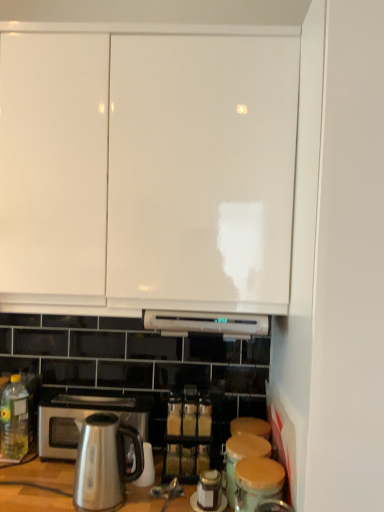
Question: Is wooden lid canister at lower center, which appears as the second appliance when viewed from the front, bigger than yellow translucent bottle at lower left?

Choices:
 (A) yes
 (B) no

Answer: (A)

Question: Is the position of wooden lid canister at lower center, the first appliance when ordered from back to front, more distant than that of yellow translucent bottle at lower left?

Choices:
 (A) yes
 (B) no

Answer: (B)

Question: Can you confirm if wooden lid canister at lower center, which appears as the second appliance when viewed from the front, is taller than yellow translucent bottle at lower left?

Choices:
 (A) yes
 (B) no

Answer: (B)

Question: Does wooden lid canister at lower center, the first appliance when ordered from back to front, have a greater width compared to yellow translucent bottle at lower left?

Choices:
 (A) yes
 (B) no

Answer: (A)

Question: Are wooden lid canister at lower center, the first appliance when ordered from back to front, and yellow translucent bottle at lower left making contact?

Choices:
 (A) yes
 (B) no

Answer: (B)

Question: Is wooden lid canister at lower center, which appears as the second appliance when viewed from the front, thinner than yellow translucent bottle at lower left?

Choices:
 (A) yes
 (B) no

Answer: (B)

Question: Does matte brown canister at lower right, the 2th appliance from the back, lie behind satin silver microwave oven at lower left?

Choices:
 (A) no
 (B) yes

Answer: (A)

Question: Is matte brown canister at lower right, the first appliance in the front-to-back sequence, not inside satin silver microwave oven at lower left?

Choices:
 (A) no
 (B) yes

Answer: (B)

Question: Is matte brown canister at lower right, the first appliance in the front-to-back sequence, looking in the opposite direction of satin silver microwave oven at lower left?

Choices:
 (A) yes
 (B) no

Answer: (B)

Question: Is matte brown canister at lower right, the first appliance in the front-to-back sequence, in contact with satin silver microwave oven at lower left?

Choices:
 (A) no
 (B) yes

Answer: (A)

Question: Does matte brown canister at lower right, the first appliance in the front-to-back sequence, have a larger size compared to satin silver microwave oven at lower left?

Choices:
 (A) no
 (B) yes

Answer: (A)

Question: From a real-world perspective, does matte brown canister at lower right, the first appliance in the front-to-back sequence, sit lower than satin silver microwave oven at lower left?

Choices:
 (A) yes
 (B) no

Answer: (A)

Question: Can you confirm if matte brown canister at lower right, the first appliance in the front-to-back sequence, is positioned to the right of satin metallic kettle at lower left?

Choices:
 (A) yes
 (B) no

Answer: (A)